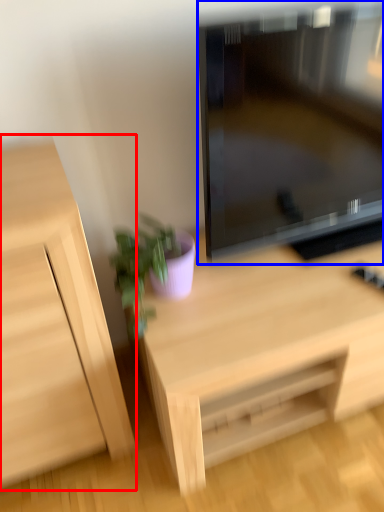
Question: Which object is closer to the camera taking this photo, cabinetry (highlighted by a red box) or television (highlighted by a blue box)?

Choices:
 (A) cabinetry
 (B) television

Answer: (A)